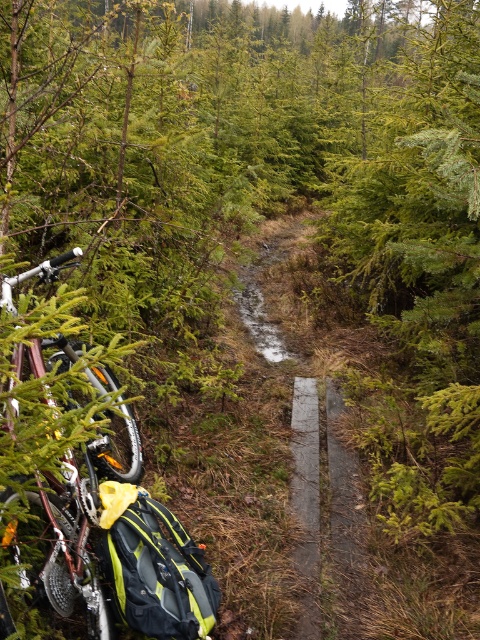
Question: Considering the real-world distances, which object is farthest from the brown wooden plank at center?

Choices:
 (A) smooth concrete path at center
 (B) silver metallic bicycle at left

Answer: (B)

Question: From the image, what is the correct spatial relationship of silver metallic bicycle at left in relation to smooth concrete path at center?

Choices:
 (A) left
 (B) right

Answer: (A)

Question: Where is silver metallic bicycle at left located in relation to smooth concrete path at center in the image?

Choices:
 (A) above
 (B) below

Answer: (A)

Question: Is silver metallic bicycle at left bigger than brown wooden plank at center?

Choices:
 (A) no
 (B) yes

Answer: (B)

Question: Which object is positioned farthest from the smooth concrete path at center?

Choices:
 (A) silver metallic bicycle at left
 (B) brown wooden plank at center

Answer: (B)

Question: Among these points, which one is farthest from the camera?

Choices:
 (A) (342, 572)
 (B) (298, 513)

Answer: (B)